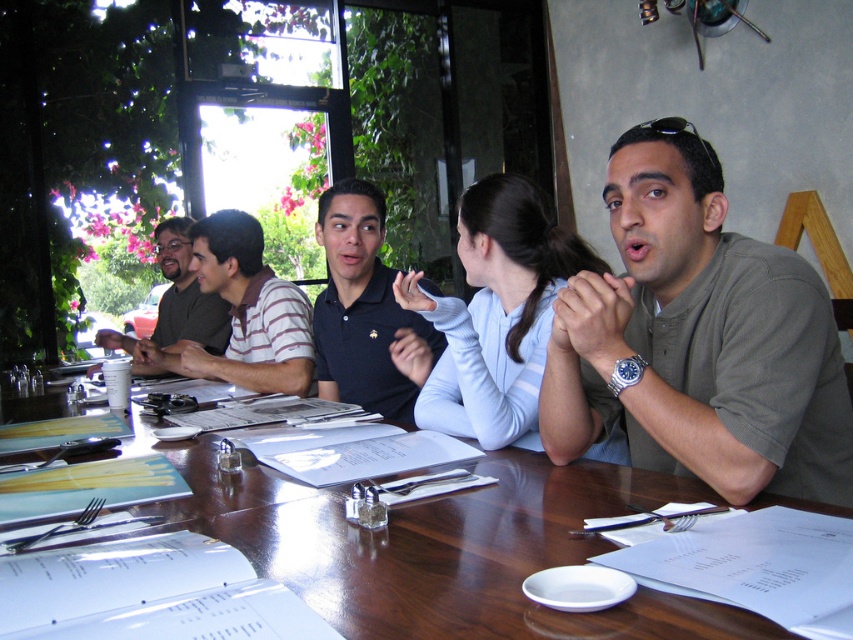
Does light blue sweater at center appear under striped cotton shirt at center?

Yes.

Looking at this image, who is positioned more to the right, light blue sweater at center or striped cotton shirt at center?

From the viewer's perspective, light blue sweater at center appears more on the right side.

You are a GUI agent. You are given a task and a screenshot of the screen. Output one action in this format:
    pyautogui.click(x=<x>, y=<y>)
    Task: Click on the light blue sweater at center
    The image size is (853, 640).
    Given the screenshot: What is the action you would take?
    pyautogui.click(x=496, y=314)

Does light blue sweater at center have a greater width compared to matte green shirt at left?

No.

Which of these two, light blue sweater at center or matte green shirt at left, stands shorter?

Standing shorter between the two is light blue sweater at center.

At what (x,y) coordinates should I click in order to perform the action: click on light blue sweater at center. Please return your answer as a coordinate pair (x, y). Looking at the image, I should click on (496, 314).

Describe the element at coordinates (364, 310) in the screenshot. The image size is (853, 640). I see `black polo shirt at center` at that location.

Is point (442, 337) less distant than point (273, 289)?

Yes, it is.

The image size is (853, 640). In order to click on black polo shirt at center in this screenshot , I will do `click(364, 310)`.